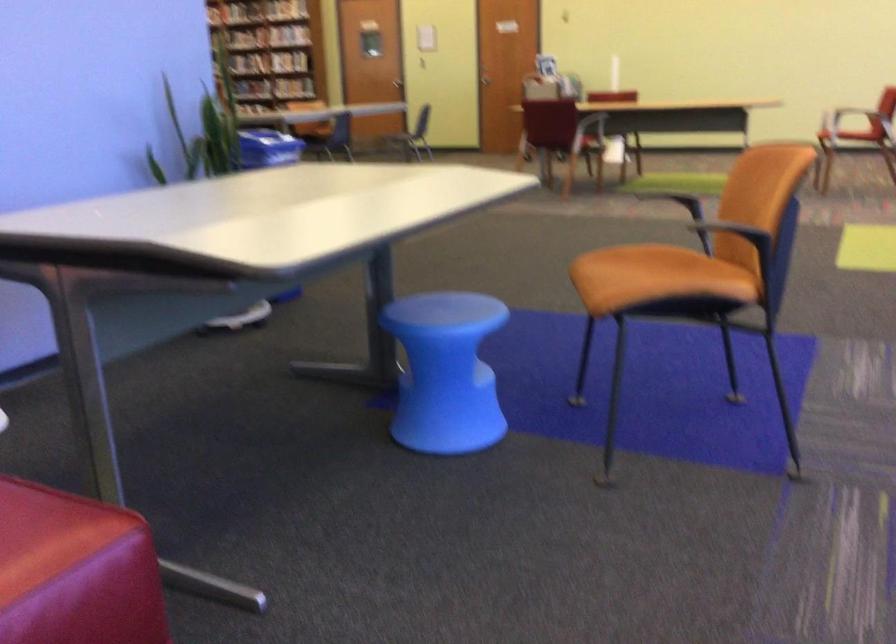
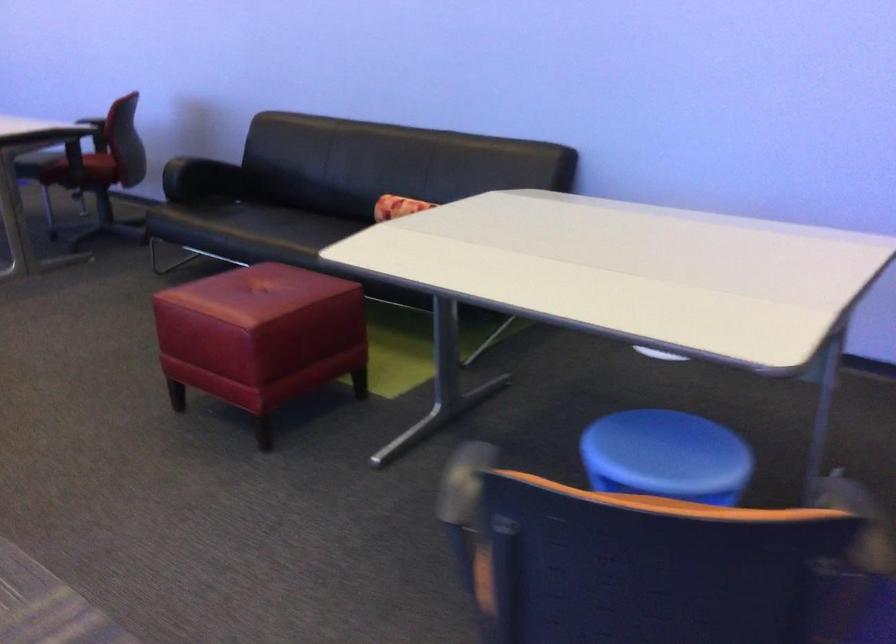
Question: I am providing you with two images of the same scene from different viewpoints. Which of the following objects are not visible in image2?

Choices:
 (A) sofa sitting surface
 (B) orange flip-flop
 (C) blue stool
 (D) blue round stool

Answer: (C)